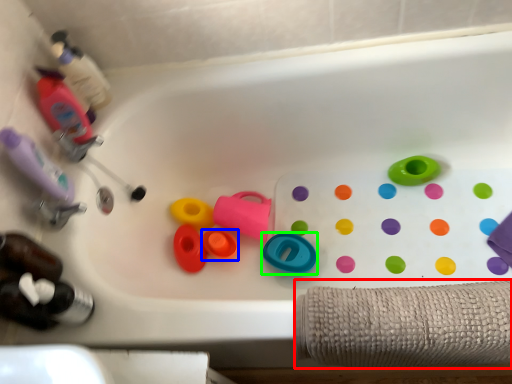
Question: Which is nearer to the bath towel (highlighted by a red box)? toy (highlighted by a blue box) or toy (highlighted by a green box).

Choices:
 (A) toy
 (B) toy

Answer: (B)